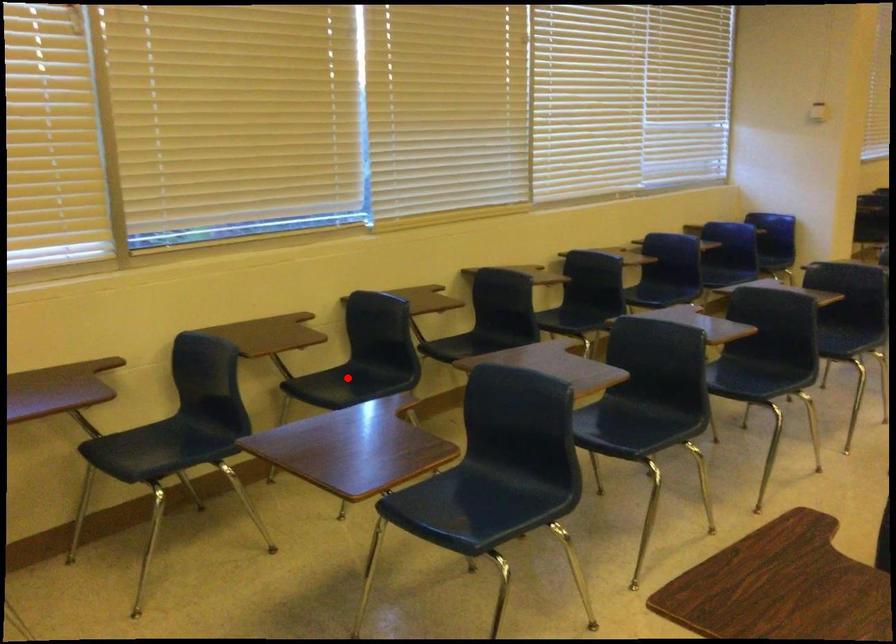
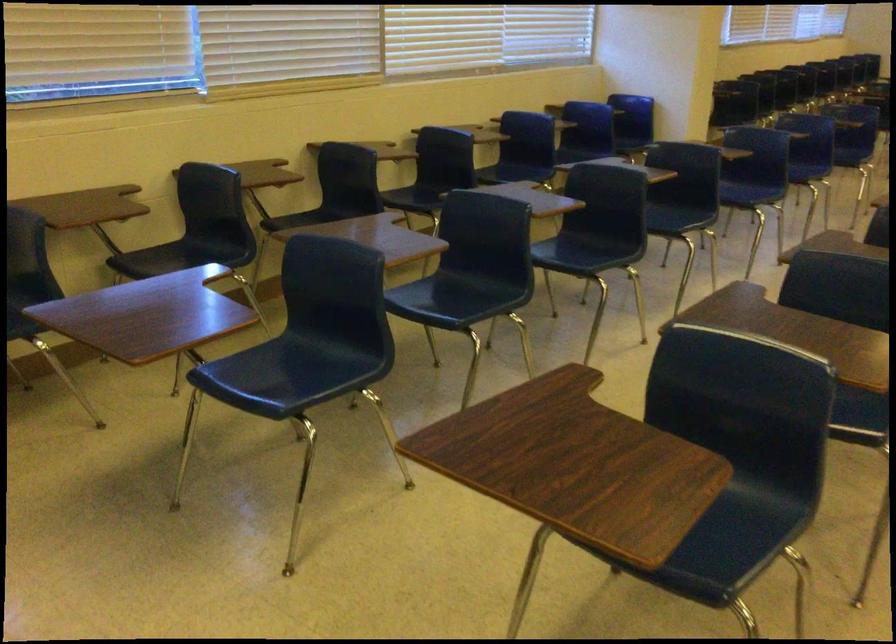
The point at the highlighted location is marked in the first image. Where is the corresponding point in the second image?

(181, 257)